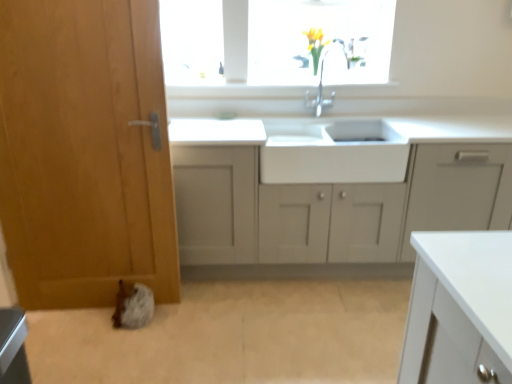
At what (x,y) coordinates should I click in order to perform the action: click on wooden door at left. Please return your answer as a coordinate pair (x, y). Looking at the image, I should click on pos(84,152).

The image size is (512, 384). Identify the location of white glossy sink at center. (332, 151).

Who is shorter, white glossy sink at center or white matte cabinet at center?

white glossy sink at center is shorter.

From a real-world perspective, relative to white matte cabinet at center, is white glossy sink at center vertically above or below?

white glossy sink at center is above white matte cabinet at center.

In the scene shown: In the image, is white glossy sink at center on the left side or the right side of white matte cabinet at center?

white glossy sink at center is to the left of white matte cabinet at center.

Does wooden door at left have a lesser height compared to white matte cabinet at center?

No.

How different are the orientations of wooden door at left and white matte cabinet at center in degrees?

They differ by 0.721 degrees in their facing directions.

The width and height of the screenshot is (512, 384). I want to click on door above the white matte cabinet at center (from a real-world perspective), so [84, 152].

From a real-world perspective, relative to white matte cabinet at center, is wooden door at left vertically above or below?

In terms of real-world spatial position, wooden door at left is above white matte cabinet at center.

Between point (213, 187) and point (116, 85), which one is positioned behind?

The point (213, 187) is farther.

From the image's perspective, which one is positioned higher, white matte cabinet at center or wooden door at left?

wooden door at left appears higher in the image.

Considering the sizes of objects white matte cabinet at center and wooden door at left in the image provided, who is taller, white matte cabinet at center or wooden door at left?

wooden door at left.

How different are the orientations of white matte cabinet at center and wooden door at left in degrees?

white matte cabinet at center and wooden door at left are facing 0.721 degrees away from each other.

Does white glossy sink at center turn towards wooden door at left?

No, white glossy sink at center is not oriented towards wooden door at left.

Considering the relative positions of white glossy sink at center and wooden door at left in the image provided, is white glossy sink at center to the left of wooden door at left from the viewer's perspective?

In fact, white glossy sink at center is to the right of wooden door at left.

Which is closer to the camera, (292, 163) or (56, 16)?

The point (56, 16) is closer to the camera.

Considering the relative sizes of white glossy sink at center and wooden door at left in the image provided, is white glossy sink at center thinner than wooden door at left?

No.

Is white glossy sink at center a part of wooden door at left?

No, white glossy sink at center is not inside wooden door at left.

From the image's perspective, which one is positioned higher, wooden door at left or white glossy sink at center?

white glossy sink at center, from the image's perspective.

Is wooden door at left oriented towards white glossy sink at center?

No, wooden door at left does not turn towards white glossy sink at center.

Which of these two, white matte cabinet at center or white glossy sink at center, is bigger?

white matte cabinet at center.

Is white matte cabinet at center surrounding white glossy sink at center?

Yes, white glossy sink at center is a part of white matte cabinet at center.

Which object is positioned more to the left, white matte cabinet at center or white glossy sink at center?

Positioned to the left is white glossy sink at center.

You are a GUI agent. You are given a task and a screenshot of the screen. Output one action in this format:
    pyautogui.click(x=<x>, y=<y>)
    Task: Click on the sink behind the white matte cabinet at center
    The width and height of the screenshot is (512, 384).
    Given the screenshot: What is the action you would take?
    pyautogui.click(x=332, y=151)

This screenshot has width=512, height=384. Identify the location of door that appears above the white matte cabinet at center (from the image's perspective). (84, 152).

Which object lies nearer to the anchor point white glossy sink at center, white matte cabinet at center or wooden door at left?

white matte cabinet at center is closer to white glossy sink at center.

Estimate the real-world distances between objects in this image. Which object is closer to wooden door at left, white glossy sink at center or white matte cabinet at center?

white matte cabinet at center.

Estimate the real-world distances between objects in this image. Which object is closer to wooden door at left, white matte cabinet at center or white glossy sink at center?

white matte cabinet at center.

From the picture: When comparing their distances from white matte cabinet at center, does white glossy sink at center or wooden door at left seem closer?

white glossy sink at center is positioned closer to the anchor white matte cabinet at center.

From the image, which object appears to be nearer to white matte cabinet at center, wooden door at left or white glossy sink at center?

white glossy sink at center is closer to white matte cabinet at center.

Looking at the image, which one is located closer to white glossy sink at center, wooden door at left or white matte cabinet at center?

Among the two, white matte cabinet at center is located nearer to white glossy sink at center.

You are a GUI agent. You are given a task and a screenshot of the screen. Output one action in this format:
    pyautogui.click(x=<x>, y=<y>)
    Task: Click on the sink between wooden door at left and white matte cabinet at center from left to right
    
    Given the screenshot: What is the action you would take?
    pyautogui.click(x=332, y=151)